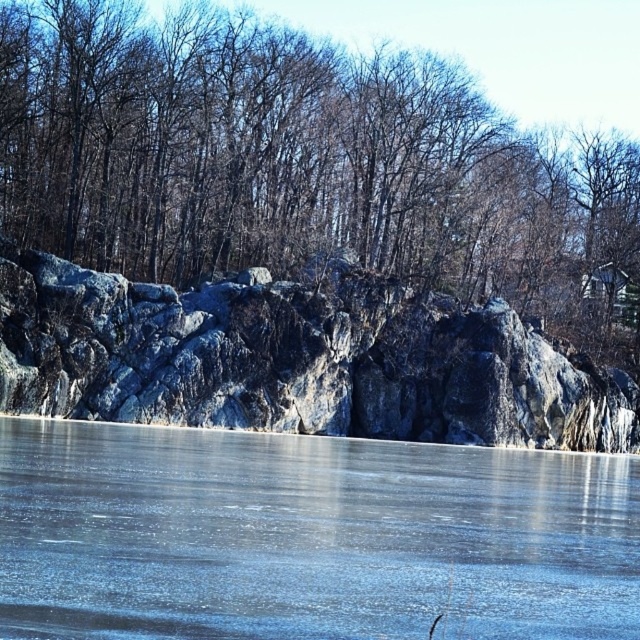
Does dark brown bark tree at upper center lie in front of granite rock formation at center?

No, it is not.

Is point (4, 99) farther from viewer compared to point (257, 323)?

Yes, it is.

What are the coordinates of `dark brown bark tree at upper center` in the screenshot? It's located at (301, 164).

Can you confirm if transparent ice at center is thinner than granite rock formation at center?

Indeed, transparent ice at center has a lesser width compared to granite rock formation at center.

Who is more distant from viewer, [81,451] or [52,282]?

The point [52,282] is behind.

Locate an element on the screen. This screenshot has width=640, height=640. transparent ice at center is located at coordinates (308, 536).

Does dark brown bark tree at upper center appear on the left side of transparent ice at center?

No, dark brown bark tree at upper center is not to the left of transparent ice at center.

Consider the image. Can you confirm if dark brown bark tree at upper center is positioned below transparent ice at center?

No, dark brown bark tree at upper center is not below transparent ice at center.

Locate an element on the screen. dark brown bark tree at upper center is located at coordinates (301, 164).